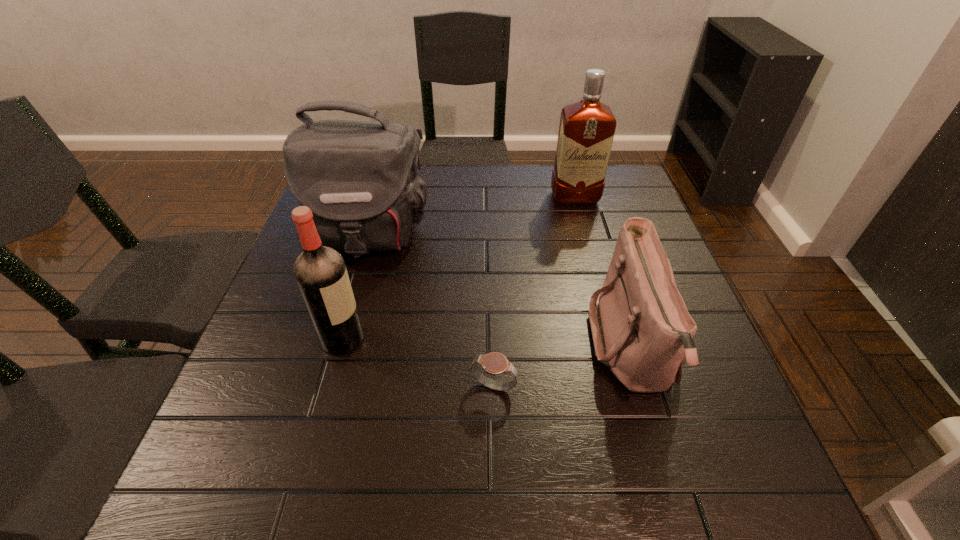
At what (x,y) coordinates should I click in order to perform the action: click on vacant area that lies between the left shoulder bag and the farther liquor. Please return your answer as a coordinate pair (x, y). Image resolution: width=960 pixels, height=540 pixels. Looking at the image, I should click on (471, 217).

You are a GUI agent. You are given a task and a screenshot of the screen. Output one action in this format:
    pyautogui.click(x=<x>, y=<y>)
    Task: Click on the unoccupied position between the left liquor and the right liquor
    Image resolution: width=960 pixels, height=540 pixels.
    Given the screenshot: What is the action you would take?
    pyautogui.click(x=459, y=268)

Where is `free area in between the taller shoulder bag and the nearer shoulder bag`? free area in between the taller shoulder bag and the nearer shoulder bag is located at coordinates (500, 292).

Where is `vacant region between the second shortest object and the left liquor`? vacant region between the second shortest object and the left liquor is located at coordinates (488, 343).

In order to click on empty space that is in between the taller shoulder bag and the right liquor in this screenshot , I will do click(x=471, y=217).

Where is `empty location between the nearer liquor and the farther liquor`? The image size is (960, 540). empty location between the nearer liquor and the farther liquor is located at coordinates (459, 268).

At what (x,y) coordinates should I click in order to perform the action: click on object that is the fourth nearest to the farther shoulder bag. Please return your answer as a coordinate pair (x, y). The width and height of the screenshot is (960, 540). Looking at the image, I should click on (641, 328).

At what (x,y) coordinates should I click in order to perform the action: click on object that is the closest to the right shoulder bag. Please return your answer as a coordinate pair (x, y). Image resolution: width=960 pixels, height=540 pixels. Looking at the image, I should click on tap(494, 363).

Where is `blank space that satisfies the following two spatial constraints: 1. on the front-facing side of the left liquor; 2. on the back side of the third object from right to left`? blank space that satisfies the following two spatial constraints: 1. on the front-facing side of the left liquor; 2. on the back side of the third object from right to left is located at coordinates (329, 388).

The height and width of the screenshot is (540, 960). I want to click on free space in the image that satisfies the following two spatial constraints: 1. on the front-facing side of the left liquor; 2. on the back side of the shortest object, so click(x=329, y=388).